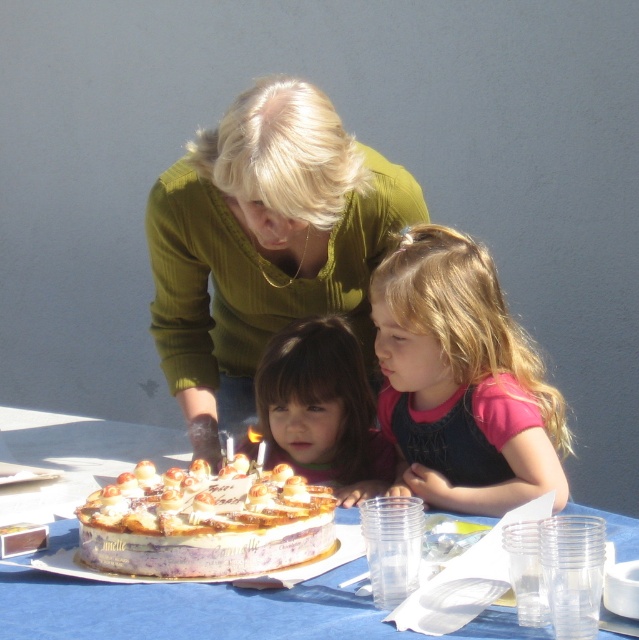
Question: Is pink fabric shirt at center above smooth brown hair at center?

Choices:
 (A) no
 (B) yes

Answer: (B)

Question: Which object appears farthest from the camera in this image?

Choices:
 (A) white paper plate at center
 (B) green ribbed sweater at center
 (C) pink fabric shirt at center
 (D) smooth brown hair at center

Answer: (A)

Question: Is green ribbed sweater at center thinner than white paper plate at center?

Choices:
 (A) no
 (B) yes

Answer: (B)

Question: Which of the following is the closest to the observer?

Choices:
 (A) (551, 472)
 (B) (309, 358)
 (C) (160, 497)
 (D) (180, 230)

Answer: (C)

Question: Which object is farther from the camera taking this photo?

Choices:
 (A) pink fabric shirt at center
 (B) green ribbed sweater at center

Answer: (B)

Question: Considering the relative positions of golden glaze cake at center and smooth brown hair at center in the image provided, where is golden glaze cake at center located with respect to smooth brown hair at center?

Choices:
 (A) right
 (B) left

Answer: (B)